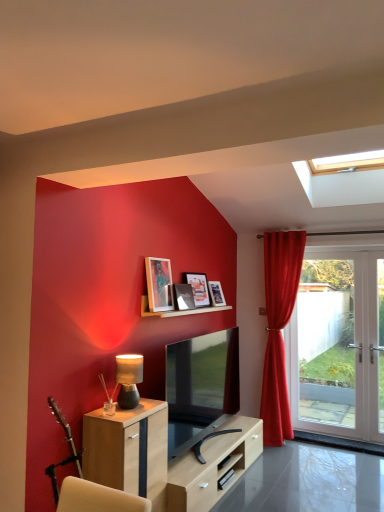
Describe the element at coordinates (178, 311) in the screenshot. I see `wooden shelf at upper center` at that location.

Find the location of `wooden picture frame at upper center, the 1th picture frame when ordered from front to back`. wooden picture frame at upper center, the 1th picture frame when ordered from front to back is located at coordinates (159, 284).

Image resolution: width=384 pixels, height=512 pixels. What do you see at coordinates (216, 293) in the screenshot? I see `matte wooden picture frame at upper center, which appears as the 1th picture frame when viewed from the back` at bounding box center [216, 293].

What do you see at coordinates (129, 450) in the screenshot?
I see `light wood cabinet at lower left` at bounding box center [129, 450].

Find the location of a particular element. The image size is (384, 512). light wood cabinet at lower left is located at coordinates (129, 450).

Where is `wooden shelf at upper center`? wooden shelf at upper center is located at coordinates (178, 311).

Could light wood cabinet at lower left be considered to be inside velvet red curtain at right?

Definitely not — light wood cabinet at lower left is not inside velvet red curtain at right.

Considering the sizes of objects velvet red curtain at right and light wood cabinet at lower left in the image provided, who is bigger, velvet red curtain at right or light wood cabinet at lower left?

With larger size is velvet red curtain at right.

In the scene shown: From a real-world perspective, which is physically above, velvet red curtain at right or light wood cabinet at lower left?

In real-world perspective, velvet red curtain at right is above.

Which is closer to the camera, (155, 273) or (213, 296)?

Point (155, 273).

Is there a large distance between wooden picture frame at upper center, the 1th picture frame when ordered from front to back, and matte wooden picture frame at upper center, which appears as the 1th picture frame when viewed from the back?

No, wooden picture frame at upper center, the 1th picture frame when ordered from front to back, is not far away from matte wooden picture frame at upper center, which appears as the 1th picture frame when viewed from the back.

Which of these two, wooden picture frame at upper center, placed as the 4th picture frame when sorted from back to front, or matte wooden picture frame at upper center, which is counted as the fourth picture frame, starting from the front, is thinner?

Thinner between the two is wooden picture frame at upper center, placed as the 4th picture frame when sorted from back to front.

Considering the relative positions of wooden picture frame at upper center, the 1th picture frame when ordered from front to back, and matte wooden picture frame at upper center, which is counted as the fourth picture frame, starting from the front, in the image provided, is wooden picture frame at upper center, the 1th picture frame when ordered from front to back, in front of matte wooden picture frame at upper center, which is counted as the fourth picture frame, starting from the front,?

Yes, it is in front of matte wooden picture frame at upper center, which is counted as the fourth picture frame, starting from the front.

Can you tell me how much wooden shelf at upper center and matte wooden picture frame at upper center, which appears as the 1th picture frame when viewed from the back, differ in facing direction?

0.261 degrees separate the facing orientations of wooden shelf at upper center and matte wooden picture frame at upper center, which appears as the 1th picture frame when viewed from the back.

Starting from the wooden shelf at upper center, which picture frame is the 2nd one to the right? Please provide its 2D coordinates.

[(216, 293)]

Is wooden shelf at upper center shorter than matte wooden picture frame at upper center, which appears as the 1th picture frame when viewed from the back?

Correct, wooden shelf at upper center is not as tall as matte wooden picture frame at upper center, which appears as the 1th picture frame when viewed from the back.

Can you confirm if wooden shelf at upper center is bigger than matte wooden picture frame at upper center, which appears as the 1th picture frame when viewed from the back?

Correct, wooden shelf at upper center is larger in size than matte wooden picture frame at upper center, which appears as the 1th picture frame when viewed from the back.

From a real-world perspective, is wooden picture frame at upper center, the 1th picture frame when ordered from front to back, located higher than velvet red curtain at right?

Yes, from a real-world perspective, wooden picture frame at upper center, the 1th picture frame when ordered from front to back, is above velvet red curtain at right.

I want to click on the 4th picture frame in front of the velvet red curtain at right, so click(x=159, y=284).

Consider the image. Is wooden picture frame at upper center, the 1th picture frame when ordered from front to back, facing away from velvet red curtain at right?

No, wooden picture frame at upper center, the 1th picture frame when ordered from front to back, is not facing away from velvet red curtain at right.

Consider the image. Considering the sizes of objects matte wooden picture frame at upper center, which is counted as the fourth picture frame, starting from the front, and velvet red curtain at right in the image provided, who is shorter, matte wooden picture frame at upper center, which is counted as the fourth picture frame, starting from the front, or velvet red curtain at right?

Standing shorter between the two is matte wooden picture frame at upper center, which is counted as the fourth picture frame, starting from the front.

Choose the correct answer: Is matte wooden picture frame at upper center, which appears as the 1th picture frame when viewed from the back, inside velvet red curtain at right or outside it?

The correct answer is: outside.

Starting from the velvet red curtain at right, which picture frame is the 1st one in front? Please provide its 2D coordinates.

[(216, 293)]

How different are the orientations of matte wooden picture frame at upper center, which is counted as the fourth picture frame, starting from the front, and velvet red curtain at right in degrees?

There is a 88-degree angle between the facing directions of matte wooden picture frame at upper center, which is counted as the fourth picture frame, starting from the front, and velvet red curtain at right.

In order to click on the 2nd picture frame to the right of the wooden shelf at upper center, counting from the anchor's position in this screenshot , I will do `click(216, 293)`.

Can you confirm if matte wooden picture frame at upper center, which appears as the 1th picture frame when viewed from the back, is shorter than wooden shelf at upper center?

No.

Is matte wooden picture frame at upper center, which appears as the 1th picture frame when viewed from the back, next to wooden shelf at upper center?

No, matte wooden picture frame at upper center, which appears as the 1th picture frame when viewed from the back, is not touching wooden shelf at upper center.

Looking at this image, is wooden picture frame at upper center, the 1th picture frame when ordered from front to back, surrounded by matte wooden picture frame at upper center, arranged as the third picture frame when viewed from the front?

No, wooden picture frame at upper center, the 1th picture frame when ordered from front to back, is not a part of matte wooden picture frame at upper center, arranged as the third picture frame when viewed from the front.

Looking at the image, does matte wooden picture frame at upper center, acting as the second picture frame starting from the back, seem bigger or smaller compared to wooden picture frame at upper center, the 1th picture frame when ordered from front to back?

Considering their sizes, matte wooden picture frame at upper center, acting as the second picture frame starting from the back, takes up more space than wooden picture frame at upper center, the 1th picture frame when ordered from front to back.

In the scene shown: From the image's perspective, which is below, matte wooden picture frame at upper center, arranged as the third picture frame when viewed from the front, or wooden picture frame at upper center, the 1th picture frame when ordered from front to back?

matte wooden picture frame at upper center, arranged as the third picture frame when viewed from the front, is shown below in the image.

Which is more distant, [190,278] or [160,306]?

The point [190,278] is farther.

Identify the location of curtain positioned vertically above the light wood cabinet at lower left (from a real-world perspective). (279, 329).

At what (x,y) coordinates should I click in order to perform the action: click on the 2nd picture frame directly beneath the wooden picture frame at upper center, the 1th picture frame when ordered from front to back (from a real-world perspective). Please return your answer as a coordinate pair (x, y). Looking at the image, I should click on (216, 293).

Looking at the image, which one is located closer to velvet red curtain at right, wooden shelf at upper center or wooden picture frame at upper center, placed as the 4th picture frame when sorted from back to front?

Among the two, wooden shelf at upper center is located nearer to velvet red curtain at right.

Based on their spatial positions, is velvet red curtain at right or wooden picture frame at upper center, placed as the 4th picture frame when sorted from back to front, closer to matte black tv at center?

wooden picture frame at upper center, placed as the 4th picture frame when sorted from back to front, is closer to matte black tv at center.

Estimate the real-world distances between objects in this image. Which object is closer to matte wooden picture frame at upper center, which appears as the 1th picture frame when viewed from the back, velvet red curtain at right or light wood cabinet at lower left?

Based on the image, velvet red curtain at right appears to be nearer to matte wooden picture frame at upper center, which appears as the 1th picture frame when viewed from the back.

Estimate the real-world distances between objects in this image. Which object is further from wooden picture frame at upper center, placed as the 4th picture frame when sorted from back to front, matte black tv at center or matte black table lamp at lower left?

matte black table lamp at lower left.

From the image, which object appears to be farther from wooden picture frame at upper center, the 1th picture frame when ordered from front to back, velvet red curtain at right or white glass door at right?

Based on the image, white glass door at right appears to be further to wooden picture frame at upper center, the 1th picture frame when ordered from front to back.

Estimate the real-world distances between objects in this image. Which object is closer to white glass door at right, light wood cabinet at lower left or matte wooden picture frame at upper center, arranged as the third picture frame when viewed from the front?

The object closer to white glass door at right is matte wooden picture frame at upper center, arranged as the third picture frame when viewed from the front.

Which object lies nearer to the anchor point matte black tv at center, wooden picture frame at upper center, the 1th picture frame when ordered from front to back, or matte wooden picture frame at upper center, arranged as the third picture frame when viewed from the front?

Based on the image, wooden picture frame at upper center, the 1th picture frame when ordered from front to back, appears to be nearer to matte black tv at center.

When comparing their distances from matte black table lamp at lower left, does light wood cabinet at lower left or white glass door at right seem closer?

Among the two, light wood cabinet at lower left is located nearer to matte black table lamp at lower left.

At what (x,y) coordinates should I click in order to perform the action: click on curtain between light wood cabinet at lower left and white glass door at right along the z-axis. Please return your answer as a coordinate pair (x, y). The height and width of the screenshot is (512, 384). Looking at the image, I should click on (279, 329).

At what (x,y) coordinates should I click in order to perform the action: click on picture frame situated between matte black tv at center and white glass door at right from left to right. Please return your answer as a coordinate pair (x, y). The height and width of the screenshot is (512, 384). Looking at the image, I should click on (216, 293).

Find the location of a particular element. table lamp located between light wood cabinet at lower left and matte glass picture frame at upper center, which is counted as the second picture frame, starting from the front, in the depth direction is located at coordinates (129, 379).

Image resolution: width=384 pixels, height=512 pixels. What are the coordinates of `television that lies between wooden shelf at upper center and light wood cabinet at lower left from top to bottom` in the screenshot? It's located at (201, 384).